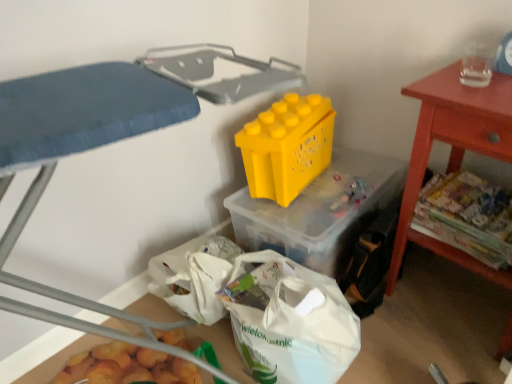
Question: Should I look upward or downward to see yellow plastic toy at center?

Choices:
 (A) up
 (B) down

Answer: (A)

Question: Considering the relative sizes of smooth red table at right and yellow plastic storage box at center, which appears as the 1th storage box when viewed from the top, in the image provided, is smooth red table at right thinner than yellow plastic storage box at center, which appears as the 1th storage box when viewed from the top,?

Choices:
 (A) yes
 (B) no

Answer: (A)

Question: Is yellow plastic storage box at center, placed as the second storage box when sorted from left to right, a part of smooth red table at right?

Choices:
 (A) yes
 (B) no

Answer: (B)

Question: From a real-world perspective, is smooth red table at right under yellow plastic storage box at center, which appears as the 1th storage box when viewed from the top?

Choices:
 (A) no
 (B) yes

Answer: (A)

Question: From the image's perspective, is smooth red table at right beneath yellow plastic storage box at center, positioned as the second storage box in bottom-to-top order?

Choices:
 (A) yes
 (B) no

Answer: (B)

Question: Can you confirm if smooth red table at right is bigger than yellow plastic storage box at center, positioned as the second storage box in bottom-to-top order?

Choices:
 (A) no
 (B) yes

Answer: (B)

Question: Does smooth red table at right turn towards yellow plastic storage box at center, which appears as the 1th storage box when viewed from the top?

Choices:
 (A) no
 (B) yes

Answer: (A)

Question: From the image's perspective, is yellow plastic storage bin at upper center on yellow plastic storage box at center, which is the 1th storage box in right-to-left order?

Choices:
 (A) no
 (B) yes

Answer: (A)

Question: Could you tell me if yellow plastic storage bin at upper center is turned towards yellow plastic storage box at center, positioned as the second storage box in bottom-to-top order?

Choices:
 (A) no
 (B) yes

Answer: (B)

Question: Are yellow plastic storage bin at upper center and yellow plastic storage box at center, which is the 1th storage box in right-to-left order, beside each other?

Choices:
 (A) no
 (B) yes

Answer: (A)

Question: Does yellow plastic storage bin at upper center have a greater height compared to yellow plastic storage box at center, positioned as the second storage box in bottom-to-top order?

Choices:
 (A) yes
 (B) no

Answer: (A)

Question: Is yellow plastic storage bin at upper center to the right of yellow plastic storage box at center, which appears as the 1th storage box when viewed from the top, from the viewer's perspective?

Choices:
 (A) no
 (B) yes

Answer: (A)

Question: Considering the relative sizes of yellow plastic storage bin at upper center and yellow plastic storage box at center, positioned as the second storage box in bottom-to-top order, in the image provided, is yellow plastic storage bin at upper center wider than yellow plastic storage box at center, positioned as the second storage box in bottom-to-top order,?

Choices:
 (A) yes
 (B) no

Answer: (A)

Question: Does yellow plastic storage box at center, positioned as the second storage box in bottom-to-top order, appear on the right side of yellow plastic storage bin at upper center?

Choices:
 (A) no
 (B) yes

Answer: (B)